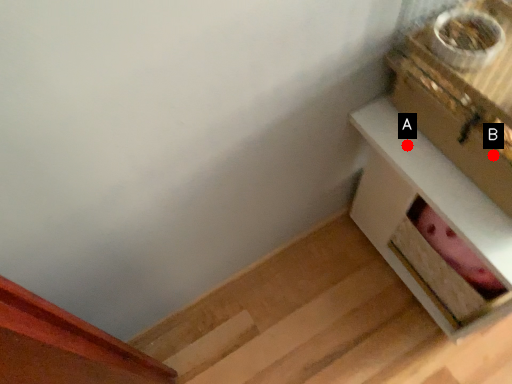
Question: Two points are circled on the image, labeled by A and B beside each circle. Among these points, which one is farthest from the camera?

Choices:
 (A) A is further
 (B) B is further

Answer: (A)